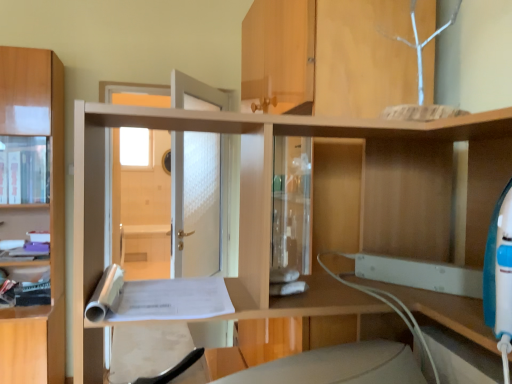
Question: Is matte wood cabinet at left positioned with its back to light brown wood cabinet at left?

Choices:
 (A) yes
 (B) no

Answer: (A)

Question: Can you confirm if matte wood cabinet at left is wider than light brown wood cabinet at left?

Choices:
 (A) yes
 (B) no

Answer: (B)

Question: Is matte wood cabinet at left to the left of light brown wood cabinet at left from the viewer's perspective?

Choices:
 (A) yes
 (B) no

Answer: (A)

Question: Is matte wood cabinet at left positioned in front of light brown wood cabinet at left?

Choices:
 (A) no
 (B) yes

Answer: (A)

Question: Can you confirm if matte wood cabinet at left is taller than light brown wood cabinet at left?

Choices:
 (A) no
 (B) yes

Answer: (A)

Question: Can you confirm if matte wood cabinet at left is shorter than light brown wood cabinet at left?

Choices:
 (A) yes
 (B) no

Answer: (A)

Question: From a real-world perspective, is light brown wood cabinet at left on matte wood cabinet at left?

Choices:
 (A) no
 (B) yes

Answer: (A)

Question: Is light brown wood cabinet at left looking in the opposite direction of matte wood cabinet at left?

Choices:
 (A) yes
 (B) no

Answer: (A)

Question: Considering the relative positions of light brown wood cabinet at left and matte wood cabinet at left in the image provided, is light brown wood cabinet at left behind matte wood cabinet at left?

Choices:
 (A) yes
 (B) no

Answer: (B)

Question: Does light brown wood cabinet at left have a greater height compared to matte wood cabinet at left?

Choices:
 (A) no
 (B) yes

Answer: (B)

Question: Is the position of light brown wood cabinet at left less distant than that of matte wood cabinet at left?

Choices:
 (A) no
 (B) yes

Answer: (B)

Question: Is light brown wood cabinet at left touching matte wood cabinet at left?

Choices:
 (A) yes
 (B) no

Answer: (B)

Question: From a real-world perspective, is light brown wood cabinet at left physically located above or below matte wood cabinet at left?

Choices:
 (A) below
 (B) above

Answer: (A)